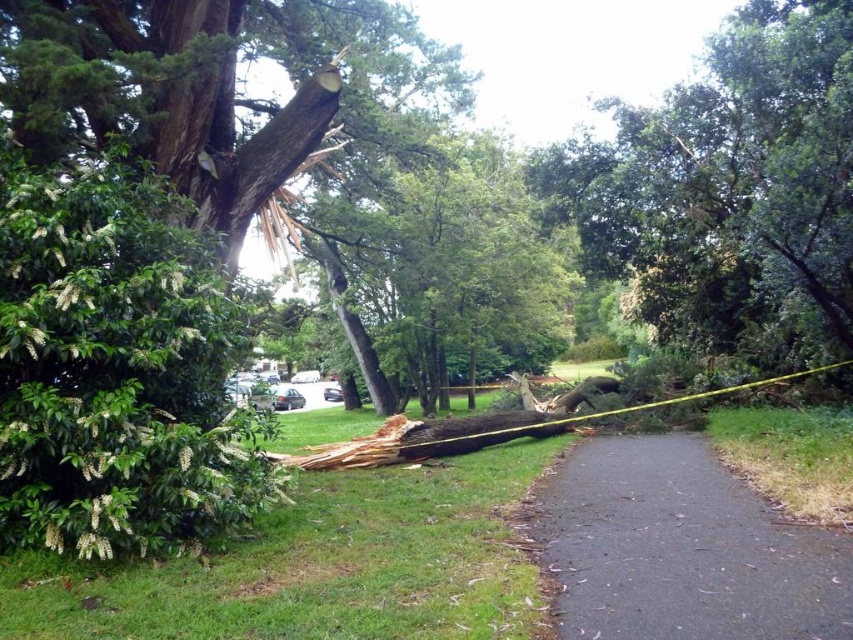
Who is positioned more to the left, black asphalt path at center or green textured trunk at center?

green textured trunk at center is more to the left.

At what (x,y) coordinates should I click in order to perform the action: click on black asphalt path at center. Please return your answer as a coordinate pair (x, y). This screenshot has width=853, height=640. Looking at the image, I should click on (680, 548).

Identify the location of black asphalt path at center. This screenshot has width=853, height=640. (680, 548).

Is brown rough wood at center bigger than green textured trunk at center?

Actually, brown rough wood at center might be smaller than green textured trunk at center.

Which is above, brown rough wood at center or green textured trunk at center?

Positioned higher is brown rough wood at center.

Image resolution: width=853 pixels, height=640 pixels. Describe the element at coordinates (730, 189) in the screenshot. I see `brown rough wood at center` at that location.

At what (x,y) coordinates should I click in order to perform the action: click on brown rough wood at center. Please return your answer as a coordinate pair (x, y). The height and width of the screenshot is (640, 853). Looking at the image, I should click on (730, 189).

What do you see at coordinates (730, 189) in the screenshot?
I see `brown rough wood at center` at bounding box center [730, 189].

Does brown rough wood at center have a greater width compared to black asphalt path at center?

Correct, the width of brown rough wood at center exceeds that of black asphalt path at center.

This screenshot has width=853, height=640. Identify the location of brown rough wood at center. (730, 189).